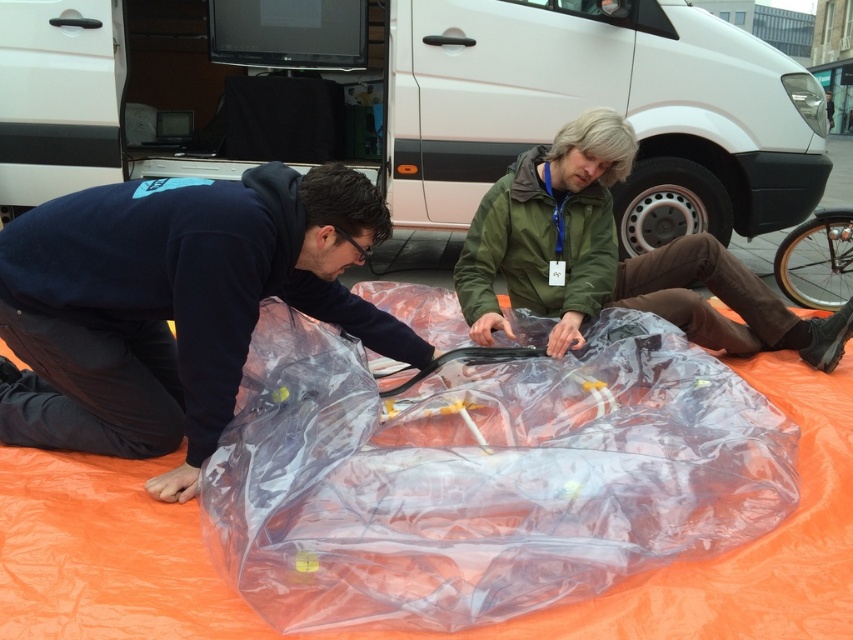
Question: Among these objects, which one is nearest to the camera?

Choices:
 (A) transparent plastic wrap at center
 (B) green matte jacket at center
 (C) white matte van at upper center
 (D) transparent plastic bag at left

Answer: (A)

Question: Which of the following is the farthest from the observer?

Choices:
 (A) (126, 358)
 (B) (686, 262)

Answer: (B)

Question: Which point is farther to the camera?

Choices:
 (A) (566, 42)
 (B) (413, 324)

Answer: (A)

Question: Does white matte van at upper center have a smaller size compared to transparent plastic bag at left?

Choices:
 (A) yes
 (B) no

Answer: (A)

Question: Does transparent plastic wrap at center have a greater width compared to transparent plastic bag at left?

Choices:
 (A) no
 (B) yes

Answer: (B)

Question: Does transparent plastic wrap at center lie in front of green matte jacket at center?

Choices:
 (A) yes
 (B) no

Answer: (A)